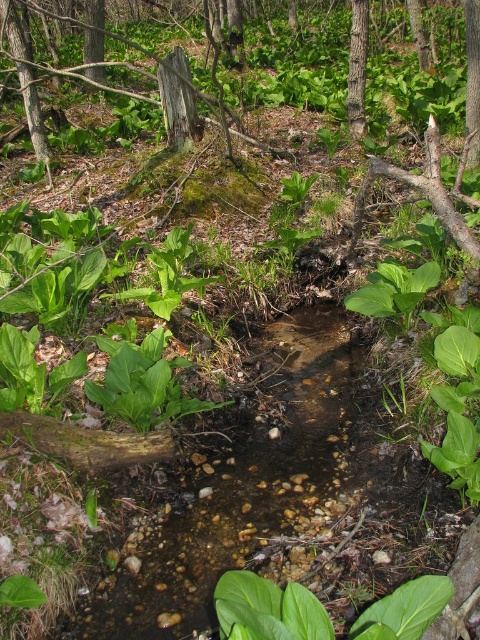
Is point (348, 96) positioned after point (474, 112)?

Yes.

Find the location of a particular element. The height and width of the screenshot is (640, 480). smooth bark tree at center is located at coordinates (358, 67).

The image size is (480, 640). I want to click on smooth bark tree at center, so click(358, 67).